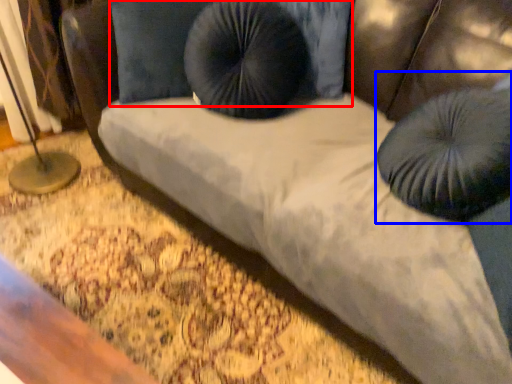
Question: Which object is closer to the camera taking this photo, pillow (highlighted by a red box) or bean bag chair (highlighted by a blue box)?

Choices:
 (A) pillow
 (B) bean bag chair

Answer: (B)